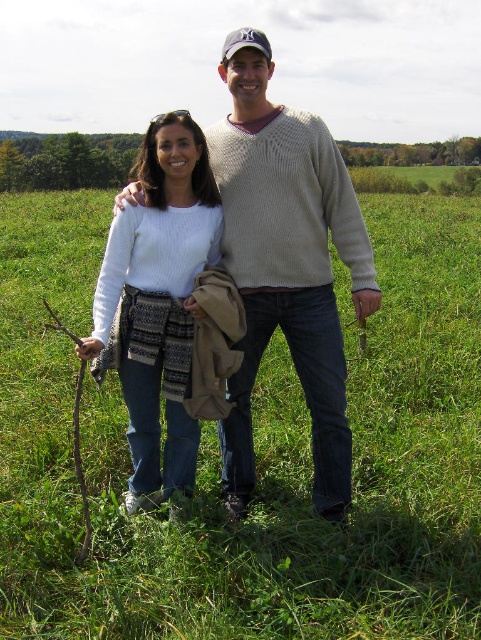
Question: Which of these objects is positioned closest to the white knit sweater at center?

Choices:
 (A) white knitted sweater at center
 (B) green grassy field at center

Answer: (A)

Question: Can you confirm if green grassy field at center is positioned to the left of white knit sweater at center?

Choices:
 (A) no
 (B) yes

Answer: (A)

Question: Which point is farther to the camera?

Choices:
 (A) white knitted sweater at center
 (B) green grassy field at center

Answer: (A)

Question: Which point is closer to the camera?

Choices:
 (A) brown rough twig at lower left
 (B) white knit sweater at center
 (C) green grassy field at center
 (D) white knitted sweater at center

Answer: (C)

Question: Is green grassy field at center smaller than white knitted sweater at center?

Choices:
 (A) no
 (B) yes

Answer: (A)

Question: In this image, where is green grassy field at center located relative to white knitted sweater at center?

Choices:
 (A) right
 (B) left

Answer: (A)